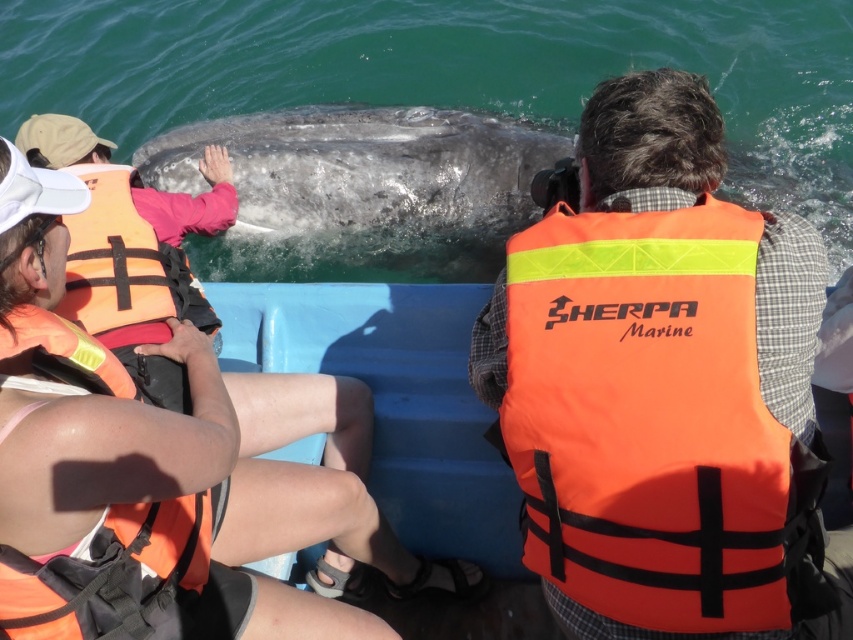
Question: Is gray textured whale at center to the right of orange fabric life jacket at lower left from the viewer's perspective?

Choices:
 (A) yes
 (B) no

Answer: (A)

Question: Which point is farther from the camera taking this photo?

Choices:
 (A) (120, 332)
 (B) (271, 179)
 (C) (177, 81)
 (D) (9, 545)

Answer: (C)

Question: Is orange life vest at center smaller than orange life vest at upper left?

Choices:
 (A) no
 (B) yes

Answer: (A)

Question: Which of the following is the farthest from the observer?

Choices:
 (A) orange fabric life jacket at lower left
 (B) glossy water at whale center
 (C) orange life vest at upper left
 (D) gray textured whale at center

Answer: (B)

Question: Does orange life vest at upper left lie behind gray textured whale at center?

Choices:
 (A) no
 (B) yes

Answer: (A)

Question: Which point appears farthest from the camera in this image?

Choices:
 (A) (42, 588)
 (B) (138, 442)
 (C) (103, 172)
 (D) (384, 26)

Answer: (D)